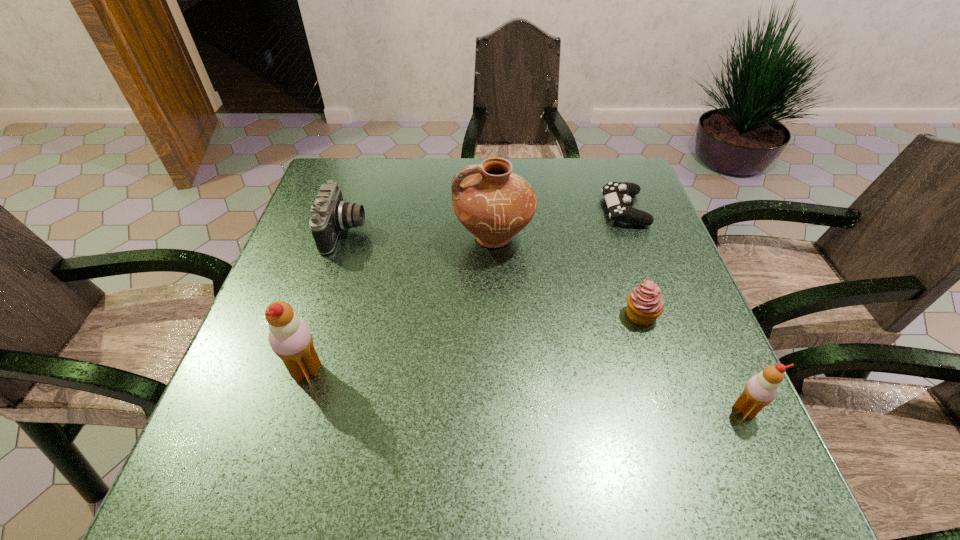
The height and width of the screenshot is (540, 960). In order to click on the fifth farthest object in this screenshot , I will do 290,338.

Find the location of `the left icecream`. the left icecream is located at coordinates (290, 338).

You are a GUI agent. You are given a task and a screenshot of the screen. Output one action in this format:
    pyautogui.click(x=<x>, y=<y>)
    Task: Click on the third tallest object
    
    Given the screenshot: What is the action you would take?
    [x=760, y=390]

Find the location of a particular element. The height and width of the screenshot is (540, 960). the nearer icecream is located at coordinates (760, 390).

Find the location of `the third object from left to right`. the third object from left to right is located at coordinates (493, 203).

Identify the location of the shortest object. This screenshot has width=960, height=540. (617, 195).

The height and width of the screenshot is (540, 960). Identify the location of camera. (330, 214).

In order to click on cupcake in this screenshot , I will do `click(645, 304)`.

Identify the location of the third nearest object. This screenshot has width=960, height=540. 645,304.

Where is `blank area located 0.080m at the front with a straw on the left icecream`? Image resolution: width=960 pixels, height=540 pixels. blank area located 0.080m at the front with a straw on the left icecream is located at coordinates (247, 372).